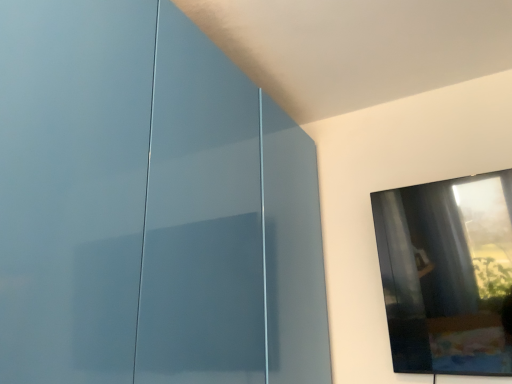
Question: Considering the positions of transparent glass window at upper right and glossy blue glass door at left in the image, is transparent glass window at upper right bigger or smaller than glossy blue glass door at left?

Choices:
 (A) small
 (B) big

Answer: (A)

Question: From the image's perspective, is transparent glass window at upper right positioned above or below glossy blue glass door at left?

Choices:
 (A) above
 (B) below

Answer: (B)

Question: Would you say transparent glass window at upper right is to the left or to the right of glossy blue glass door at left in the picture?

Choices:
 (A) right
 (B) left

Answer: (A)

Question: Considering their positions, is glossy blue glass door at left located in front of or behind transparent glass window at upper right?

Choices:
 (A) behind
 (B) front

Answer: (B)

Question: Looking at their shapes, would you say glossy blue glass door at left is wider or thinner than transparent glass window at upper right?

Choices:
 (A) thin
 (B) wide

Answer: (B)

Question: Is glossy blue glass door at left spatially inside transparent glass window at upper right, or outside of it?

Choices:
 (A) outside
 (B) inside

Answer: (A)

Question: From a real-world perspective, relative to transparent glass window at upper right, is glossy blue glass door at left vertically above or below?

Choices:
 (A) above
 (B) below

Answer: (A)